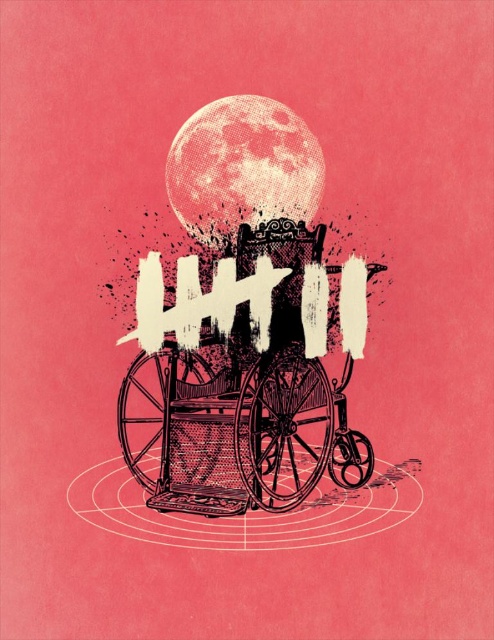
Question: Is black ink baby carriage at center above speckled pink moon at upper center?

Choices:
 (A) yes
 (B) no

Answer: (B)

Question: Is black ink baby carriage at center behind speckled pink moon at upper center?

Choices:
 (A) no
 (B) yes

Answer: (A)

Question: Can you confirm if black ink baby carriage at center is positioned to the left of speckled pink moon at upper center?

Choices:
 (A) no
 (B) yes

Answer: (A)

Question: Among these objects, which one is farthest from the camera?

Choices:
 (A) speckled pink moon at upper center
 (B) black ink baby carriage at center

Answer: (A)